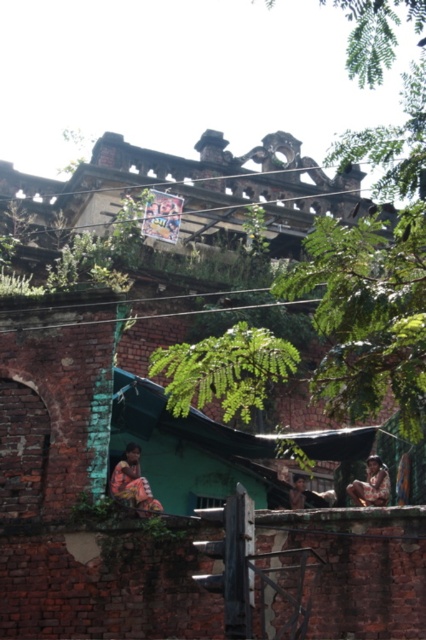
In the scene shown: Between green leafy tree at upper center and multicolored fabric at lower left, which one is positioned lower?

Positioned lower is multicolored fabric at lower left.

Does point (422, 72) lie behind point (155, 500)?

No, (422, 72) is closer to viewer.

You are a GUI agent. You are given a task and a screenshot of the screen. Output one action in this format:
    pyautogui.click(x=<x>, y=<y>)
    Task: Click on the green leafy tree at upper center
    This screenshot has width=426, height=640.
    Given the screenshot: What is the action you would take?
    pyautogui.click(x=374, y=276)

What do you see at coordinates (132, 483) in the screenshot?
I see `multicolored fabric at lower left` at bounding box center [132, 483].

Can you confirm if multicolored fabric at lower left is wider than brown textured fabric at center?

Yes, multicolored fabric at lower left is wider than brown textured fabric at center.

Is point (143, 496) positioned in front of point (377, 474)?

Yes, point (143, 496) is closer to viewer.

At what (x,y) coordinates should I click in order to perform the action: click on multicolored fabric at lower left. Please return your answer as a coordinate pair (x, y). Looking at the image, I should click on (132, 483).

Is green leafy tree at upper center taller than brown textured fabric at center?

Yes.

Is point (261, 360) closer to viewer compared to point (382, 493)?

Yes, it is.

Between point (301, 273) and point (388, 484), which one is positioned behind?

The point (388, 484) is more distant.

The image size is (426, 640). Find the location of `green leafy tree at upper center`. green leafy tree at upper center is located at coordinates (374, 276).